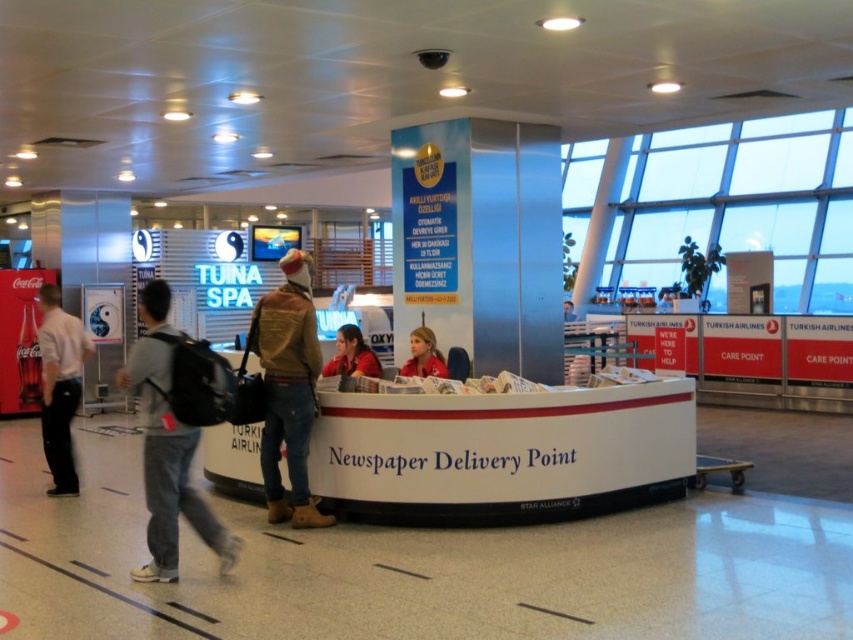
Question: Which point is farther to the camera?

Choices:
 (A) blue denim jeans at center
 (B) black backpack at left
 (C) matte red shirt at center

Answer: (A)

Question: Does black backpack at left appear on the right side of matte black backpack at left?

Choices:
 (A) yes
 (B) no

Answer: (A)

Question: Can you confirm if brown leather jacket at center is positioned to the left of blue denim jeans at center?

Choices:
 (A) no
 (B) yes

Answer: (B)

Question: Is black backpack at left below matte black backpack at left?

Choices:
 (A) no
 (B) yes

Answer: (B)

Question: Which point is farther to the camera?

Choices:
 (A) (380, 369)
 (B) (164, 317)

Answer: (A)

Question: Which of the following is the closest to the observer?

Choices:
 (A) (286, 502)
 (B) (180, 454)

Answer: (B)